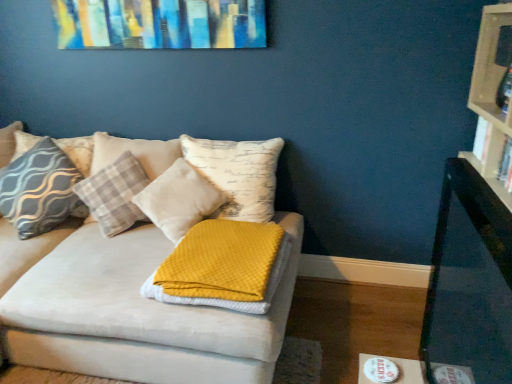
Question: Is soft white pillow at center, which appears as the 1th pillow when viewed from the right, facing towards plaid fabric pillow at left, acting as the first pillow starting from the left?

Choices:
 (A) no
 (B) yes

Answer: (A)

Question: Would you say plaid fabric pillow at left, acting as the first pillow starting from the left, is part of soft white pillow at center, which appears as the 1th pillow when viewed from the right,'s contents?

Choices:
 (A) yes
 (B) no

Answer: (B)

Question: Does soft white pillow at center, the 3th pillow in the left-to-right sequence, come behind plaid fabric pillow at left, which ranks as the third pillow in right-to-left order?

Choices:
 (A) no
 (B) yes

Answer: (A)

Question: Is plaid fabric pillow at left, which ranks as the third pillow in right-to-left order, at the back of soft white pillow at center, which appears as the 1th pillow when viewed from the right?

Choices:
 (A) yes
 (B) no

Answer: (B)

Question: Does soft white pillow at center, the 3th pillow in the left-to-right sequence, have a greater height compared to plaid fabric pillow at left, acting as the first pillow starting from the left?

Choices:
 (A) no
 (B) yes

Answer: (B)

Question: Is soft white pillow at center, the 3th pillow in the left-to-right sequence, outside of plaid fabric pillow at left, which ranks as the third pillow in right-to-left order?

Choices:
 (A) yes
 (B) no

Answer: (A)

Question: Does white paper book at right, positioned as the 2th book in front-to-back order, have a lesser width compared to hardcover book at right, acting as the second book starting from the back?

Choices:
 (A) yes
 (B) no

Answer: (B)

Question: Considering the relative positions of white paper book at right, positioned as the 2th book in front-to-back order, and hardcover book at right, which is the 1th book from front to back, in the image provided, is white paper book at right, positioned as the 2th book in front-to-back order, in front of hardcover book at right, which is the 1th book from front to back,?

Choices:
 (A) no
 (B) yes

Answer: (A)

Question: Could you tell me if white paper book at right, positioned as the 2th book in front-to-back order, is turned towards hardcover book at right, acting as the second book starting from the back?

Choices:
 (A) yes
 (B) no

Answer: (B)

Question: Are white paper book at right, positioned as the 1th book in back-to-front order, and hardcover book at right, which is the 1th book from front to back, far apart?

Choices:
 (A) no
 (B) yes

Answer: (A)

Question: Is the depth of white paper book at right, positioned as the 1th book in back-to-front order, greater than that of hardcover book at right, which is the 1th book from front to back?

Choices:
 (A) no
 (B) yes

Answer: (B)

Question: From a real-world perspective, is white paper book at right, positioned as the 1th book in back-to-front order, on hardcover book at right, which is the 1th book from front to back?

Choices:
 (A) no
 (B) yes

Answer: (B)

Question: Can you confirm if waffle-textured yellow blanket at center is positioned to the left of hardcover book at right, which is the 1th book from front to back?

Choices:
 (A) no
 (B) yes

Answer: (B)